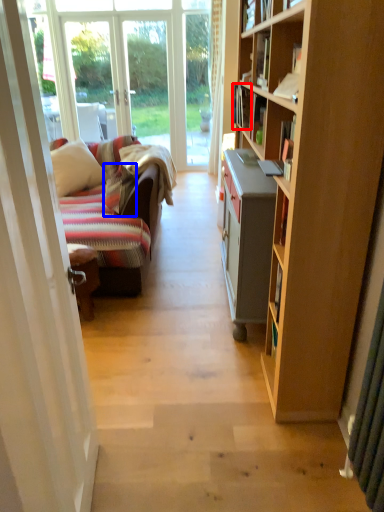
Question: Which object appears farthest to the camera in this image, book (highlighted by a red box) or pillow (highlighted by a blue box)?

Choices:
 (A) book
 (B) pillow

Answer: (B)